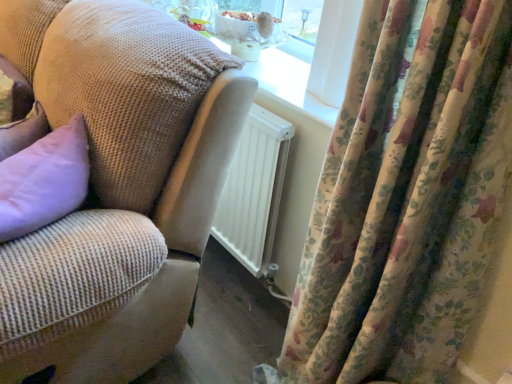
Question: From the image's perspective, is floral velvet curtains at right above or below woven fabric couch at center?

Choices:
 (A) above
 (B) below

Answer: (B)

Question: Does point (337, 339) appear closer or farther from the camera than point (131, 67)?

Choices:
 (A) farther
 (B) closer

Answer: (A)

Question: Is floral velvet curtains at right inside or outside of woven fabric couch at center?

Choices:
 (A) outside
 (B) inside

Answer: (A)

Question: From the image's perspective, is woven fabric couch at center above or below floral velvet curtains at right?

Choices:
 (A) below
 (B) above

Answer: (B)

Question: Considering their positions, is woven fabric couch at center located in front of or behind floral velvet curtains at right?

Choices:
 (A) behind
 (B) front

Answer: (A)

Question: Considering the relative positions of woven fabric couch at center and floral velvet curtains at right in the image provided, is woven fabric couch at center to the left or to the right of floral velvet curtains at right?

Choices:
 (A) left
 (B) right

Answer: (A)

Question: Do you think woven fabric couch at center is within floral velvet curtains at right, or outside of it?

Choices:
 (A) inside
 (B) outside

Answer: (B)